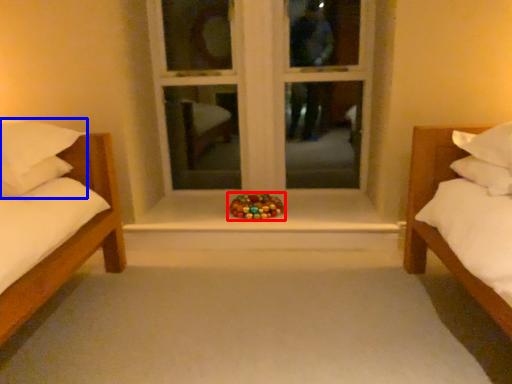
Question: Which object is closer to the camera taking this photo, toy (highlighted by a red box) or pillow (highlighted by a blue box)?

Choices:
 (A) toy
 (B) pillow

Answer: (B)